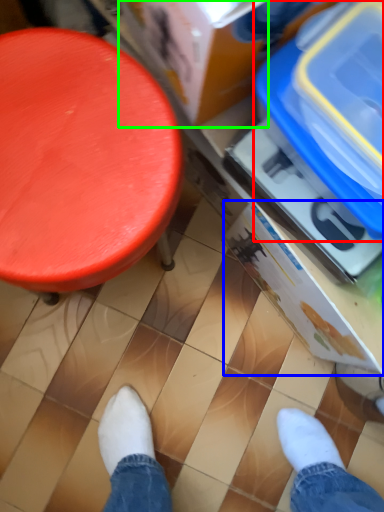
Question: Considering the real-world distances, which object is farthest from storage box (highlighted by a red box)? storage box (highlighted by a blue box) or storage box (highlighted by a green box)?

Choices:
 (A) storage box
 (B) storage box

Answer: (A)